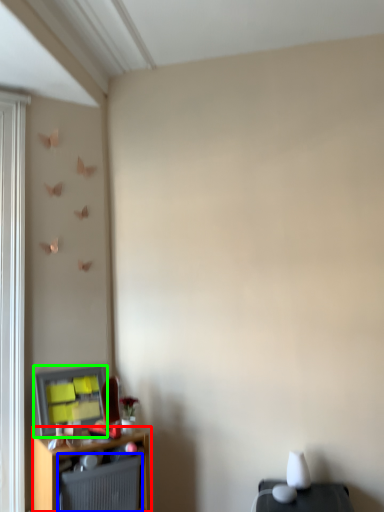
Question: Which object is the closest to the shelf (highlighted by a red box)? Choose among these: radiator (highlighted by a blue box) or window screen (highlighted by a green box).

Choices:
 (A) radiator
 (B) window screen

Answer: (A)